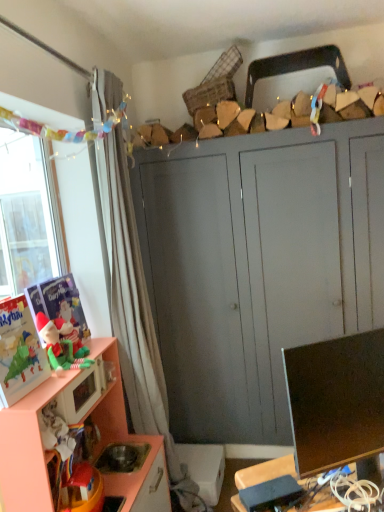
Question: Is white sheer curtain at left bigger than matte gray cabinet at center, which is counted as the 1th cabinetry, starting from the back?

Choices:
 (A) yes
 (B) no

Answer: (B)

Question: Considering the relative sizes of white sheer curtain at left and matte gray cabinet at center, which is counted as the 1th cabinetry, starting from the back, in the image provided, is white sheer curtain at left shorter than matte gray cabinet at center, which is counted as the 1th cabinetry, starting from the back,?

Choices:
 (A) no
 (B) yes

Answer: (A)

Question: Could you tell me if white sheer curtain at left is turned towards matte gray cabinet at center, which is counted as the 1th cabinetry, starting from the back?

Choices:
 (A) yes
 (B) no

Answer: (B)

Question: Is white sheer curtain at left taller than matte gray cabinet at center, the second cabinetry from the front?

Choices:
 (A) yes
 (B) no

Answer: (A)

Question: Are white sheer curtain at left and matte gray cabinet at center, which is counted as the 1th cabinetry, starting from the back, far apart?

Choices:
 (A) no
 (B) yes

Answer: (A)

Question: Would you say matte gray cabinet at center, which is counted as the 1th cabinetry, starting from the back, is part of white sheer curtain at left's contents?

Choices:
 (A) no
 (B) yes

Answer: (A)

Question: Considering the relative sizes of matte plastic toy at left, placed as the first toy when sorted from back to front, and matte gray cabinet at center, which is counted as the 1th cabinetry, starting from the back, in the image provided, is matte plastic toy at left, placed as the first toy when sorted from back to front, smaller than matte gray cabinet at center, which is counted as the 1th cabinetry, starting from the back,?

Choices:
 (A) no
 (B) yes

Answer: (B)

Question: Are matte plastic toy at left, the 2th toy in the front-to-back sequence, and matte gray cabinet at center, the second cabinetry from the front, beside each other?

Choices:
 (A) no
 (B) yes

Answer: (A)

Question: Is matte plastic toy at left, the 2th toy in the front-to-back sequence, to the left of matte gray cabinet at center, the second cabinetry from the front, from the viewer's perspective?

Choices:
 (A) yes
 (B) no

Answer: (A)

Question: Is the position of matte plastic toy at left, the 2th toy in the front-to-back sequence, more distant than that of matte gray cabinet at center, the second cabinetry from the front?

Choices:
 (A) yes
 (B) no

Answer: (B)

Question: Is matte plastic toy at left, the 2th toy in the front-to-back sequence, far away from matte gray cabinet at center, the second cabinetry from the front?

Choices:
 (A) yes
 (B) no

Answer: (A)

Question: Could matte gray cabinet at center, the second cabinetry from the front, be considered to be inside matte plastic toy at left, the 2th toy in the front-to-back sequence?

Choices:
 (A) yes
 (B) no

Answer: (B)

Question: Could matte black monitor at lower right be considered to be inside matte pink microwave at lower left?

Choices:
 (A) no
 (B) yes

Answer: (A)